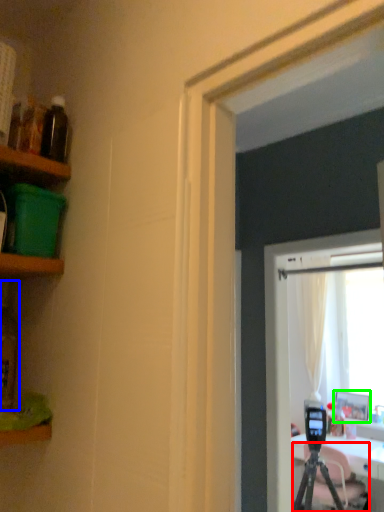
Question: Considering the real-world distances, which object is farthest from tripod (highlighted by a red box)? bottle (highlighted by a blue box) or picture frame (highlighted by a green box)?

Choices:
 (A) bottle
 (B) picture frame

Answer: (A)